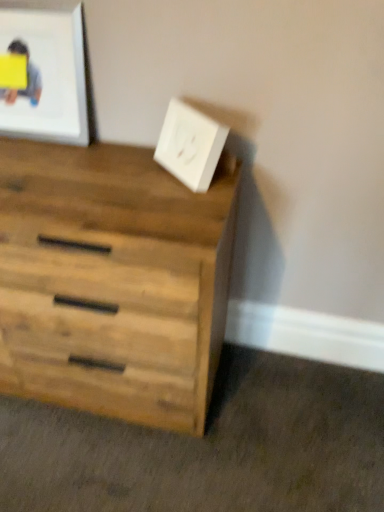
At what (x,y) coordinates should I click in order to perform the action: click on free space to the left of white matte electric outlet at upper right. Please return your answer as a coordinate pair (x, y). Looking at the image, I should click on (132, 170).